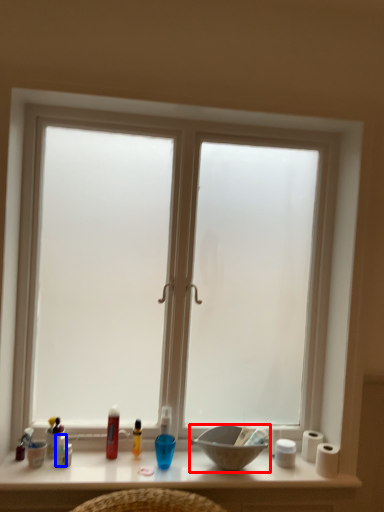
Question: Which object is further to the camera taking this photo, bowl (highlighted by a red box) or toiletry (highlighted by a blue box)?

Choices:
 (A) bowl
 (B) toiletry

Answer: (B)